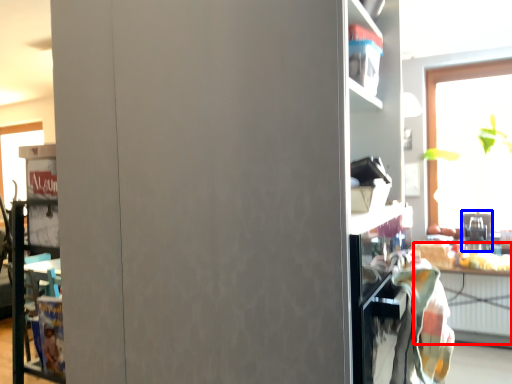
Question: Which object is closer to the camera taking this photo, table (highlighted by a red box) or appliance (highlighted by a blue box)?

Choices:
 (A) table
 (B) appliance

Answer: (A)